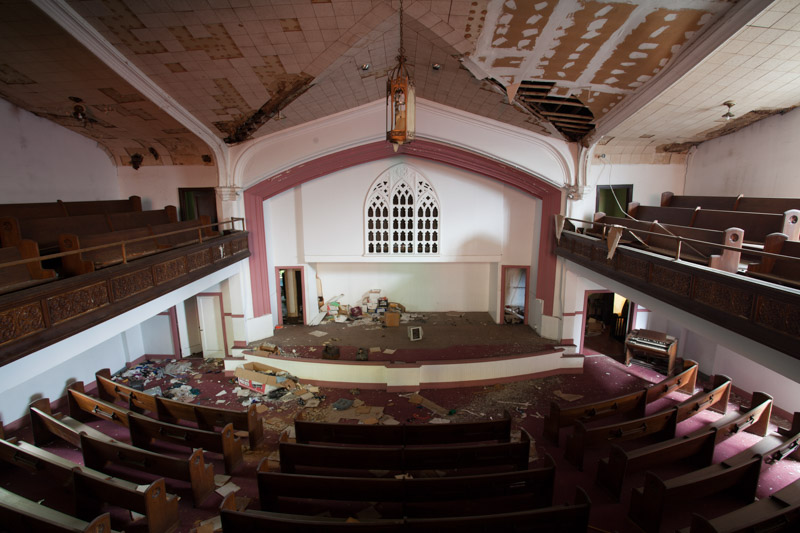
You are a GUI agent. You are given a task and a screenshot of the screen. Output one action in this format:
    pyautogui.click(x=<x>, y=<y>)
    Task: Click on the exposed roof beam
    Image resolution: width=800 pixels, height=533 pixels.
    Given the screenshot: What is the action you would take?
    pyautogui.click(x=570, y=115)